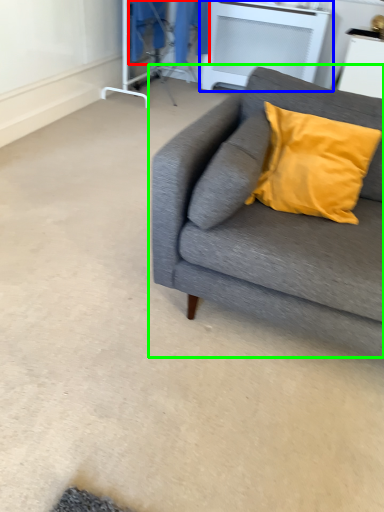
Question: Which object is positioned farthest from laundry (highlighted by a red box)? Select from table (highlighted by a blue box) and studio couch (highlighted by a green box).

Choices:
 (A) table
 (B) studio couch

Answer: (B)